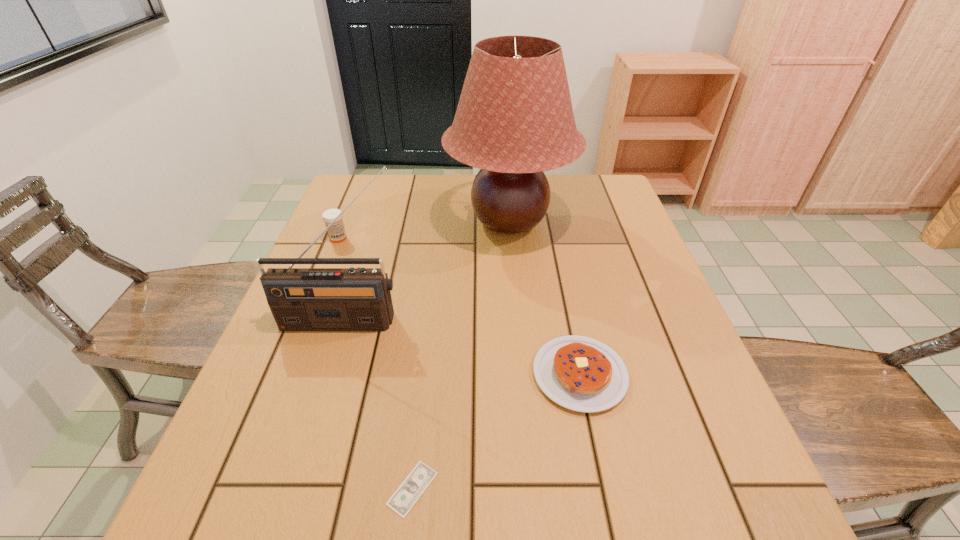
Identify the location of unoccupied position between the third farthest object and the pancake. This screenshot has width=960, height=540. (461, 348).

At what (x,y) coordinates should I click in order to perform the action: click on vacant area that lies between the lampshade and the radio receiver. Please return your answer as a coordinate pair (x, y). Looking at the image, I should click on (426, 272).

This screenshot has width=960, height=540. I want to click on vacant area between the fourth farthest object and the nearest object, so click(x=496, y=431).

Identify which object is the third nearest to the lampshade. Please provide its 2D coordinates. Your answer should be formatted as a tuple, i.e. [(x, y)], where the tuple contains the x and y coordinates of a point satisfying the conditions above.

[(336, 232)]

Find the location of a particular element. This screenshot has height=540, width=960. object that ranks as the fourth closest to the medicine is located at coordinates (411, 489).

Locate an element on the screen. The width and height of the screenshot is (960, 540). vacant space that satisfies the following two spatial constraints: 1. on the front-facing side of the money; 2. on the left side of the second tallest object is located at coordinates (289, 488).

Find the location of `vacant space that satisfies the following two spatial constraints: 1. on the front-facing side of the money; 2. on the left side of the third farthest object`. vacant space that satisfies the following two spatial constraints: 1. on the front-facing side of the money; 2. on the left side of the third farthest object is located at coordinates (289, 488).

At what (x,y) coordinates should I click in order to perform the action: click on vacant point that satisfies the following two spatial constraints: 1. on the front-facing side of the fourth tallest object; 2. on the right side of the fourth shortest object. Please return your answer as a coordinate pair (x, y). Looking at the image, I should click on (325, 374).

Find the location of a particular element. The height and width of the screenshot is (540, 960). vacant position in the image that satisfies the following two spatial constraints: 1. on the front-facing side of the second tallest object; 2. on the left side of the shortest object is located at coordinates (289, 488).

The width and height of the screenshot is (960, 540). I want to click on vacant point that satisfies the following two spatial constraints: 1. on the front-facing side of the pancake; 2. on the right side of the third farthest object, so click(325, 374).